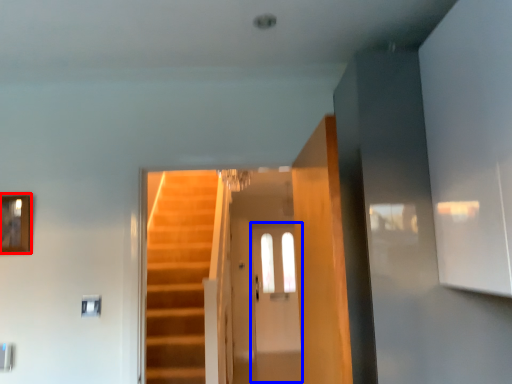
Question: Which object is closer to the camera taking this photo, picture frame (highlighted by a red box) or glass door (highlighted by a blue box)?

Choices:
 (A) picture frame
 (B) glass door

Answer: (A)